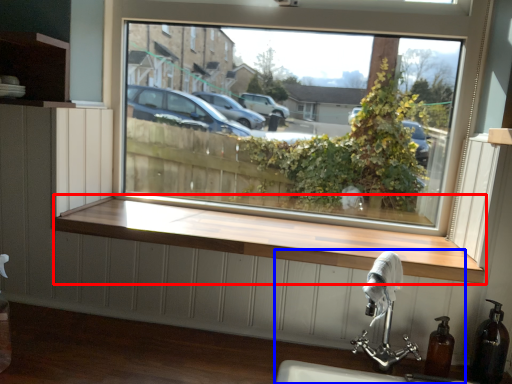
Question: Which of the following is the closest to the observer, window sill (highlighted by a red box) or sink (highlighted by a blue box)?

Choices:
 (A) window sill
 (B) sink

Answer: (B)